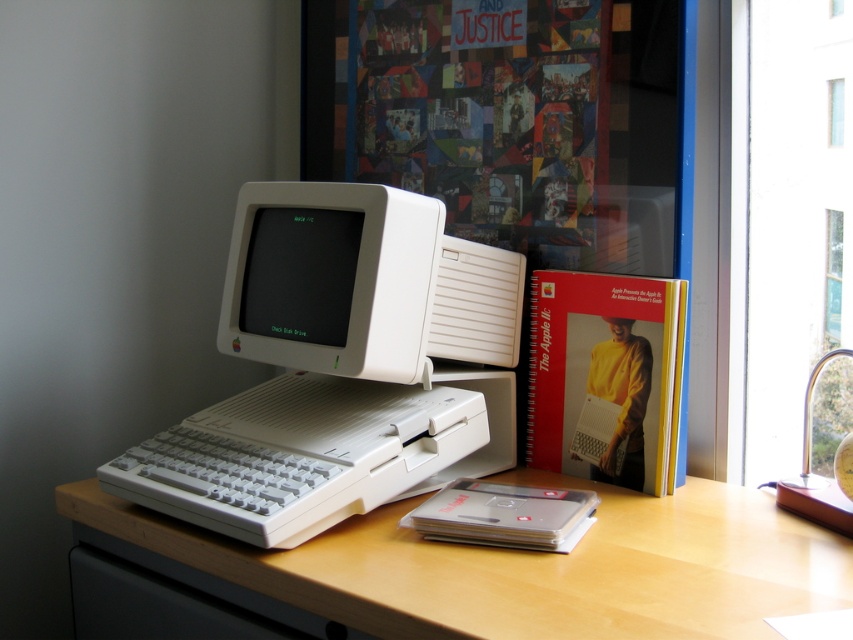
You are standing at the edge of the desk where the vintage Apple Macintosh is placed. You need to reach two points on the desk to adjust some cables. The first point is at coordinate point(230, 282) and the second point is at coordinate point(248, 252). Which point should you reach first if you want to move from the back of the desk to the front without going out of order?

You should reach point(248, 252) first because point(230, 282) is behind it, meaning point(248, 252) is closer to the front of the desk. Moving from back to front, you would encounter point(248, 252) first before reaching the point that is further back.

Looking at this image, you are a technician trying to locate the white plastic computer at center on a desk. According to the coordinates provided, where exactly should you look on the desk?

The white plastic computer at center is located at point (332,364) on the desk.